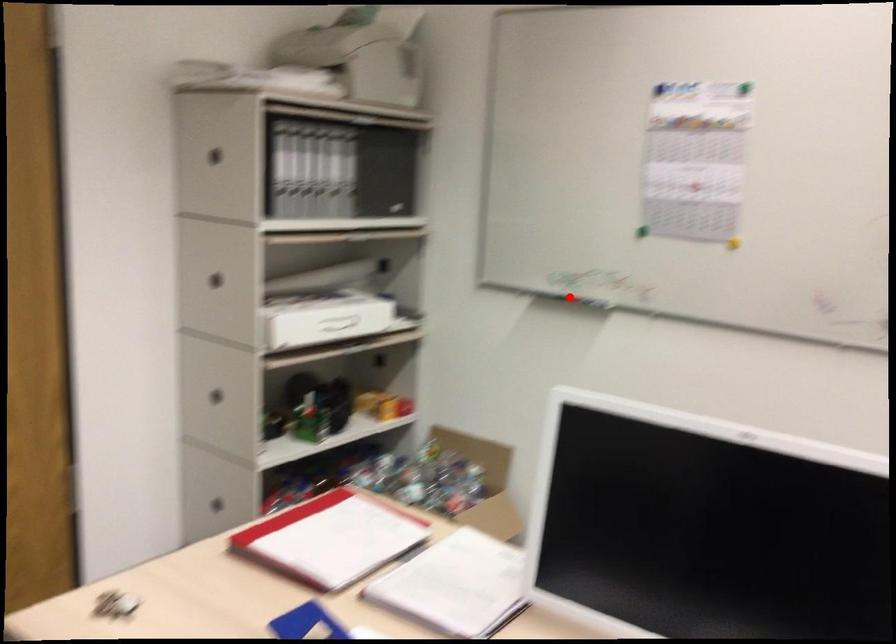
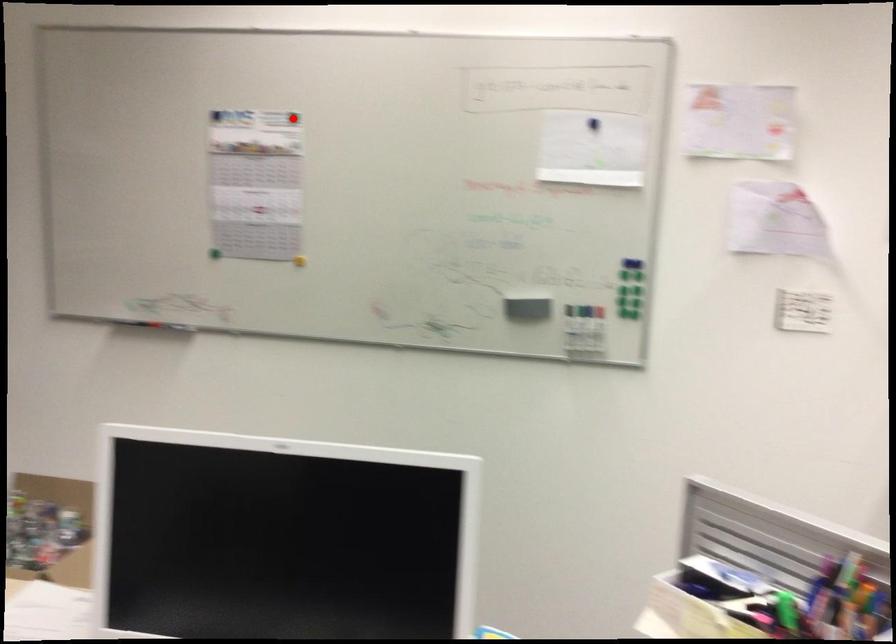
I am providing you with two images of the same scene from different viewpoints. A red point is marked on the first image and another point is marked on the second image. Does the point marked in image1 correspond to the same location as the one in image2?

No